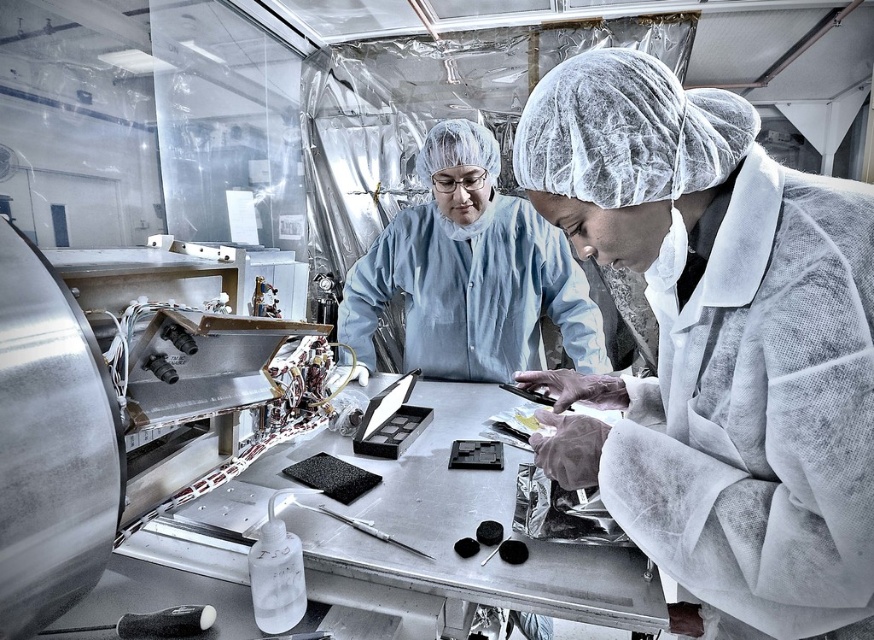
How distant is white mesh robe at center from blue fabric lab coat at center?

The distance of white mesh robe at center from blue fabric lab coat at center is 85.60 centimeters.

Is white mesh robe at center bigger than blue fabric lab coat at center?

No.

Who is more distant from viewer, (709, 298) or (531, 324)?

Point (531, 324)

Identify the location of white mesh robe at center. (760, 412).